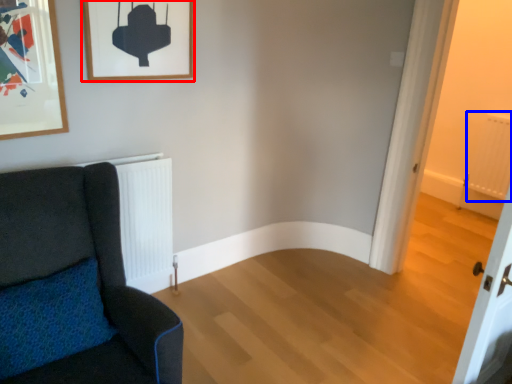
Question: Which of the following is the farthest to the observer, picture frame (highlighted by a red box) or radiator (highlighted by a blue box)?

Choices:
 (A) picture frame
 (B) radiator

Answer: (B)